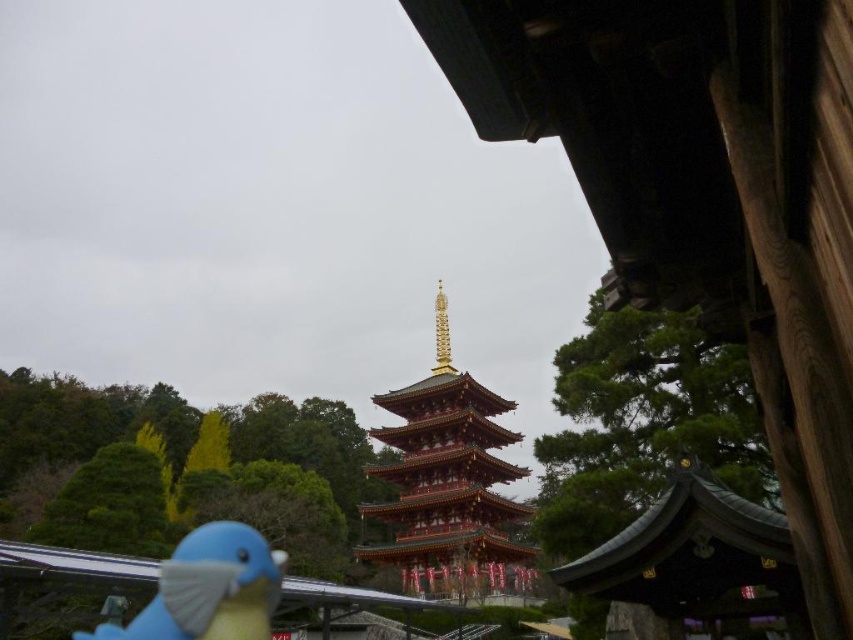
In the scene shown: Based on the provided coordinates, where is the red lacquered pagoda at center located in the image?

The red lacquered pagoda at center is located at point (448, 483).

You are standing in front of the pagoda and want to place a small statue of a dragon on the ground between the red lacquered pagoda at center and the blue matte parrot at lower left. Which direction should you walk from the pagoda to reach the correct placement spot?

You should walk to the left from the red lacquered pagoda at center because the blue matte parrot at lower left is positioned to the left of the pagoda, so the space between them is to the left side of the pagoda.